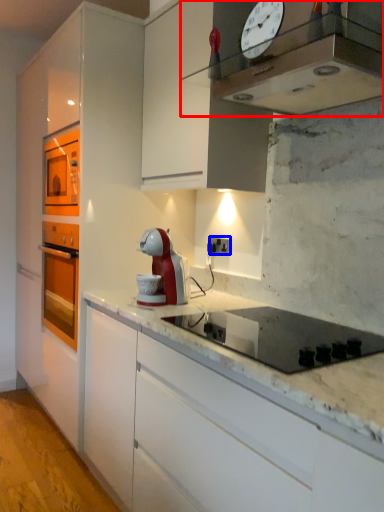
Question: Among these objects, which one is farthest to the camera, home appliance (highlighted by a red box) or electric outlet (highlighted by a blue box)?

Choices:
 (A) home appliance
 (B) electric outlet

Answer: (B)